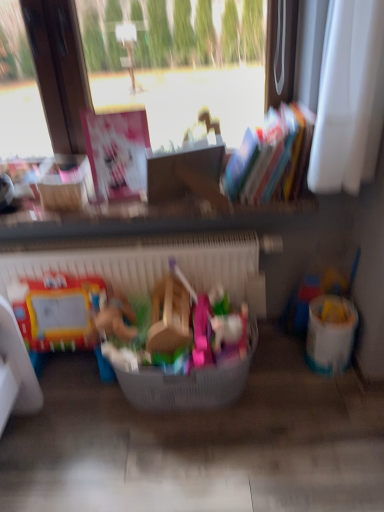
Question: From a real-world perspective, is translucent plastic bucket at right, the first toy viewed from the back, above or below white plastic radiator at center?

Choices:
 (A) above
 (B) below

Answer: (B)

Question: From the image's perspective, is translucent plastic bucket at right, acting as the 2th toy starting from the left, above or below white plastic radiator at center?

Choices:
 (A) above
 (B) below

Answer: (B)

Question: Considering the real-world distances, which object is farthest from the white plastic bucket at right?

Choices:
 (A) plastic basket at center, the first toy in the left-to-right sequence
 (B) plastic basket at center
 (C) translucent plastic bucket at right, which is the 1th toy from right to left
 (D) white plastic radiator at center
 (E) multicolored paper book at upper right

Answer: (E)

Question: Which of these objects is positioned farthest from the translucent plastic bucket at right, acting as the 2th toy starting from the left?

Choices:
 (A) white plastic bucket at right
 (B) multicolored paper book at upper right
 (C) plastic basket at center, which is counted as the first toy, starting from the front
 (D) plastic basket at center
 (E) white plastic radiator at center

Answer: (C)